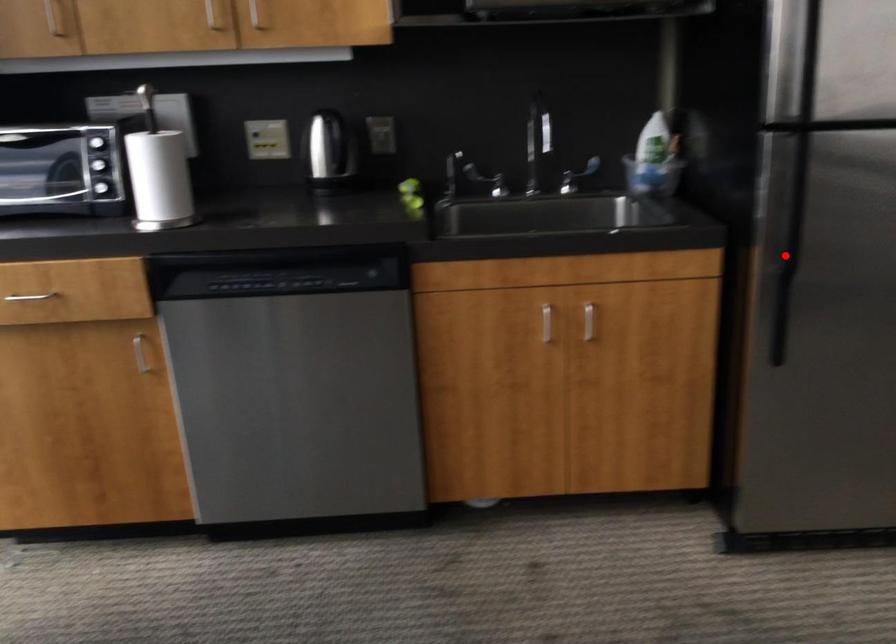
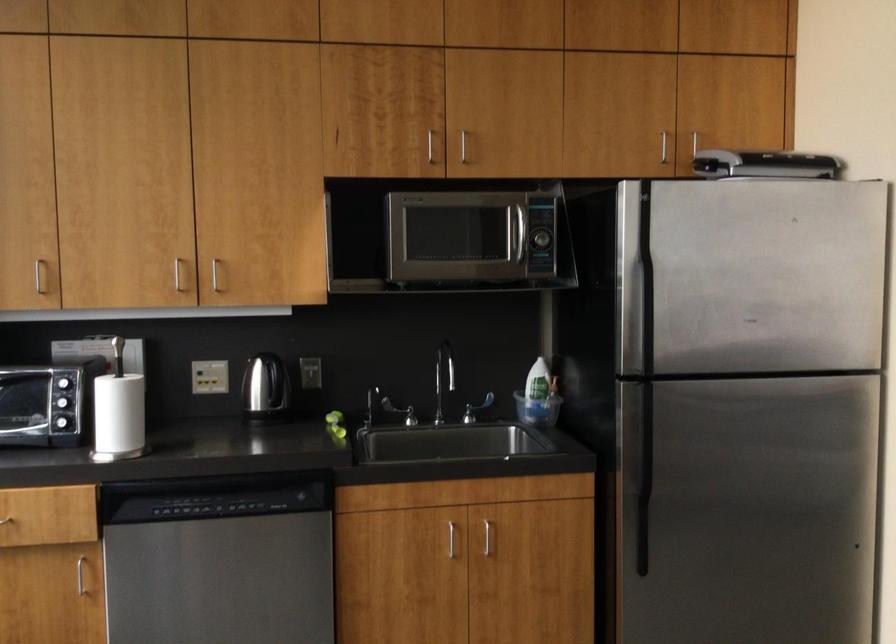
Question: I am providing you with two images of the same scene from different viewpoints. Given a red point in image1, look at the same physical point in image2. Is it:

Choices:
 (A) Closer to the viewpoint
 (B) Farther from the viewpoint

Answer: (B)